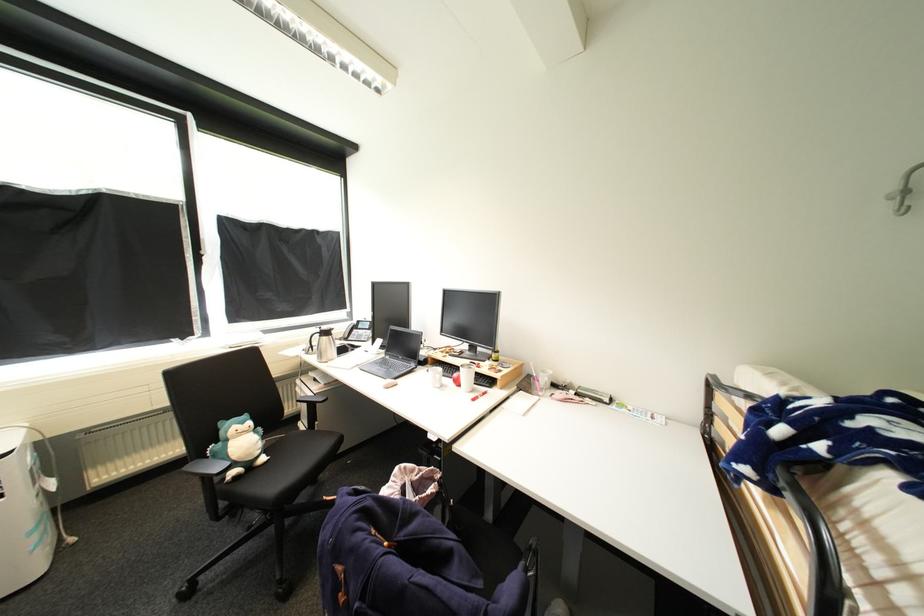
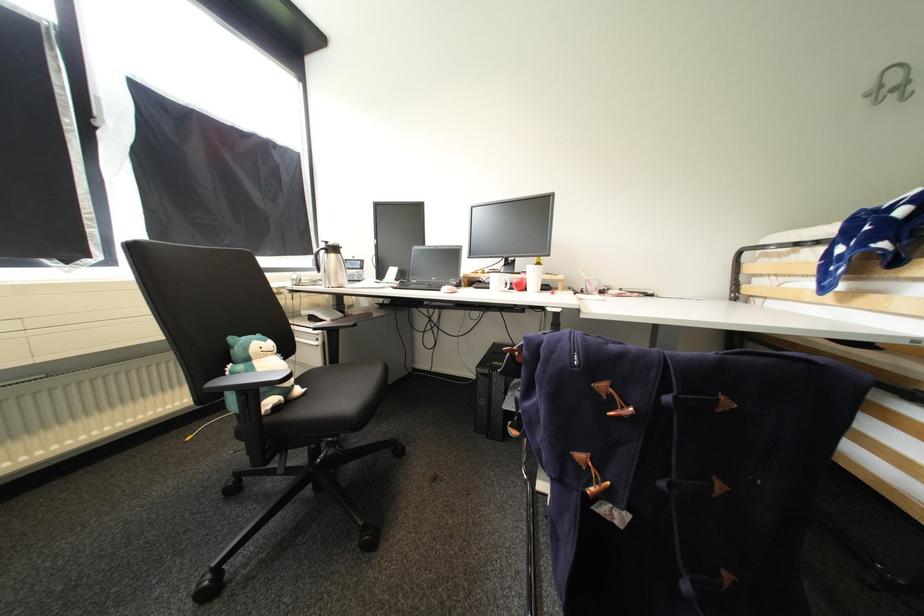
Question: The images are taken continuously from a first-person perspective. In which direction are you moving?

Choices:
 (A) Left
 (B) Right
 (C) Forward
 (D) Backward

Answer: (A)